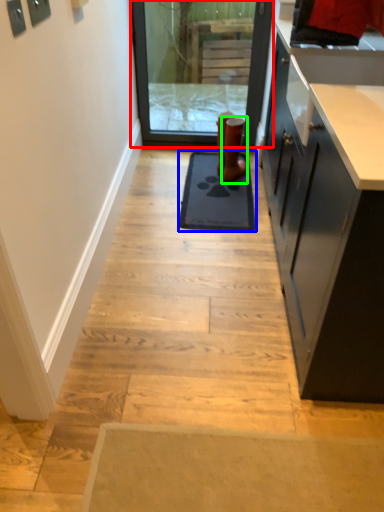
Question: Considering the real-world distances, which object is closest to screen door (highlighted by a red box)? mat (highlighted by a blue box) or footwear (highlighted by a green box).

Choices:
 (A) mat
 (B) footwear

Answer: (B)